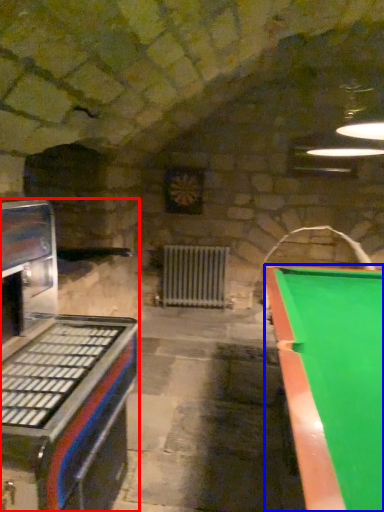
Question: Which object is further to the camera taking this photo, appliance (highlighted by a red box) or billiard table (highlighted by a blue box)?

Choices:
 (A) appliance
 (B) billiard table

Answer: (A)